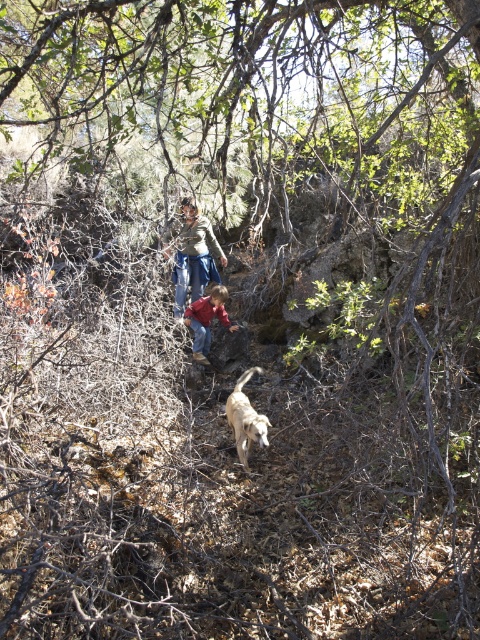
You are a hiker who wants to locate the red cotton shirt at center and the denim skirt at center in the forest scene. According to the image, which item is positioned more to the east?

The denim skirt at center is to the left of red cotton shirt at center. Since the scene is oriented with the path leading eastward, the denim skirt at center would be positioned more to the east.

What is located at the coordinates point (192, 253)?

The denim skirt at center is located at point (192, 253).

You are standing at the point marked by the coordinates point (245, 419). You want to walk to the nearest tree. Which direction should you go?

The golden fur dog at center is represented by point (245, 419). Since the nearest tree is not specified in the scene description, the direction cannot be determined based on the provided information.